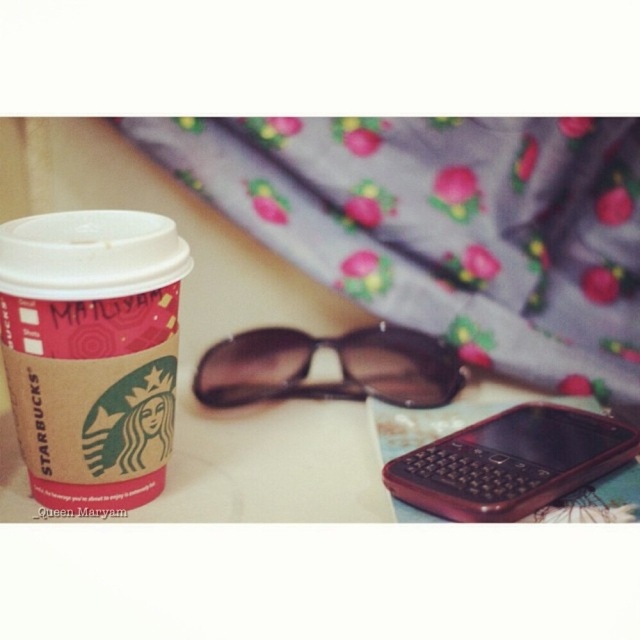
You are standing at a distance and looking at the point marked as point (29, 252) on the table. If you want to pick up an item from the table, can you reach it without moving closer than 94.56 centimeters?

The point (29, 252) is exactly 94.56 centimeters away from the viewer. Since you are already at that distance, you can reach it without needing to move closer.

What are the coordinates of the brown kraft paper cup at left?

The brown kraft paper cup at left is located at coordinates point (x=92, y=353).

You are a delivery person who needs to pick up the rubberized red phone at lower right from the table. The table is 36 inches high. Can you reach it comfortably?

The rubberized red phone at lower right is 39.19 inches away from the viewer, which is slightly taller than the table height of 36 inches. You might need to lean forward or adjust your position to comfortably reach it.